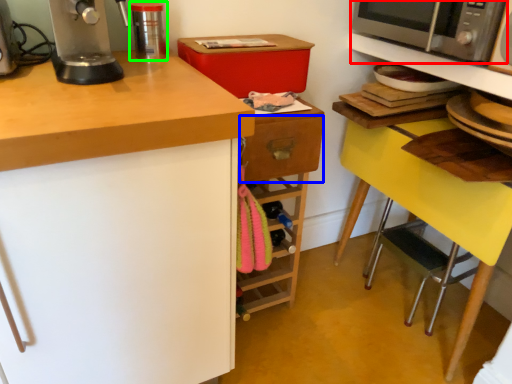
Question: Based on their relative distances, which object is nearer to microwave oven (highlighted by a red box)? Choose from drawer (highlighted by a blue box) and kitchen appliance (highlighted by a green box).

Choices:
 (A) drawer
 (B) kitchen appliance

Answer: (A)